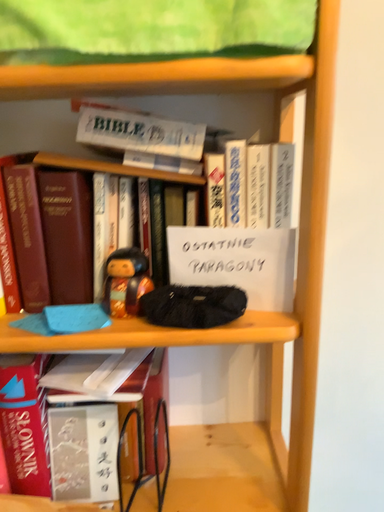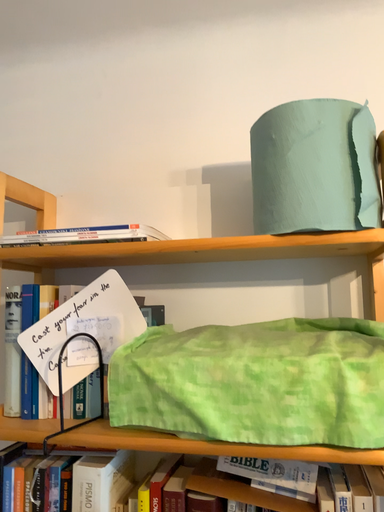
Question: Which way did the camera rotate in the video?

Choices:
 (A) rotated left
 (B) rotated right

Answer: (A)